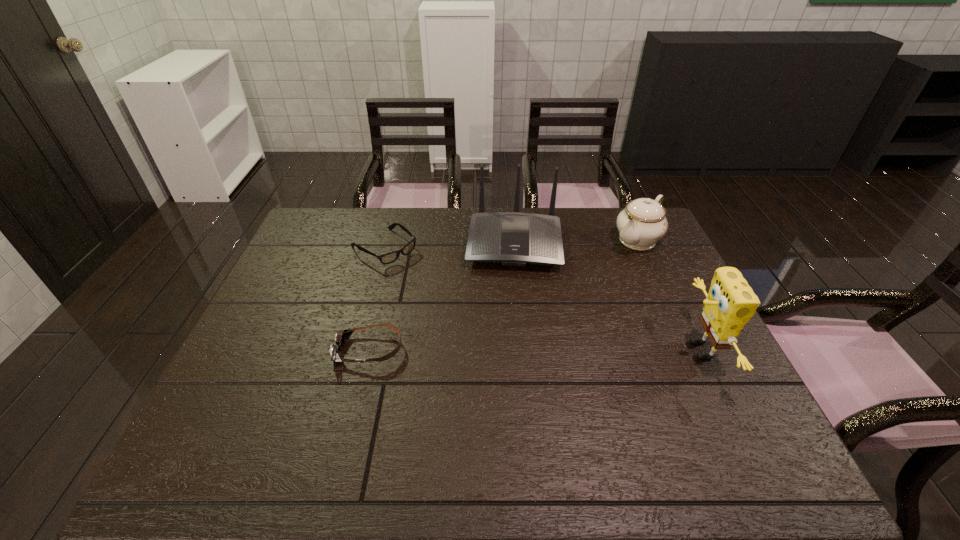
The height and width of the screenshot is (540, 960). Identify the location of free space on the desktop that is between the goggles and the sponge and is positioned on the front-facing side of the router. (x=511, y=350).

This screenshot has width=960, height=540. In order to click on vacant space on the desktop that is between the goggles and the sponge and is positioned at the spout of the third shortest object in this screenshot , I will do `click(515, 350)`.

The height and width of the screenshot is (540, 960). What are the coordinates of `vacant space on the desktop that is between the goggles and the sponge and is positioned on the front-facing side of the spectacles` in the screenshot? It's located at (516, 350).